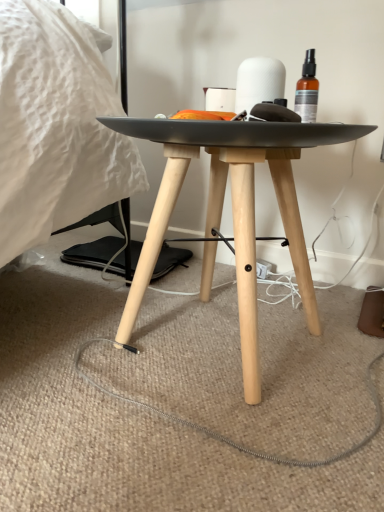
Question: Can you confirm if white matte toilet paper at center is taller than matte black table at center?

Choices:
 (A) no
 (B) yes

Answer: (A)

Question: From the image's perspective, would you say white matte toilet paper at center is shown under matte black table at center?

Choices:
 (A) yes
 (B) no

Answer: (B)

Question: From a real-world perspective, is white matte toilet paper at center on top of matte black table at center?

Choices:
 (A) no
 (B) yes

Answer: (B)

Question: Is white matte toilet paper at center positioned far away from matte black table at center?

Choices:
 (A) yes
 (B) no

Answer: (B)

Question: Is white matte toilet paper at center further to camera compared to matte black table at center?

Choices:
 (A) no
 (B) yes

Answer: (B)

Question: Is white matte toilet paper at center smaller than matte black table at center?

Choices:
 (A) yes
 (B) no

Answer: (A)

Question: Is matte black table at center positioned before white matte toilet paper at center?

Choices:
 (A) no
 (B) yes

Answer: (B)

Question: Can you confirm if matte black table at center is thinner than white matte toilet paper at center?

Choices:
 (A) no
 (B) yes

Answer: (A)

Question: Is matte black table at center located outside white matte toilet paper at center?

Choices:
 (A) no
 (B) yes

Answer: (B)

Question: Would you say matte black table at center contains white matte toilet paper at center?

Choices:
 (A) no
 (B) yes

Answer: (A)

Question: Does matte black table at center have a larger size compared to white matte toilet paper at center?

Choices:
 (A) yes
 (B) no

Answer: (A)

Question: Is matte black table at center smaller than white matte toilet paper at center?

Choices:
 (A) yes
 (B) no

Answer: (B)

Question: Is point (240, 310) closer or farther from the camera than point (241, 95)?

Choices:
 (A) closer
 (B) farther

Answer: (A)